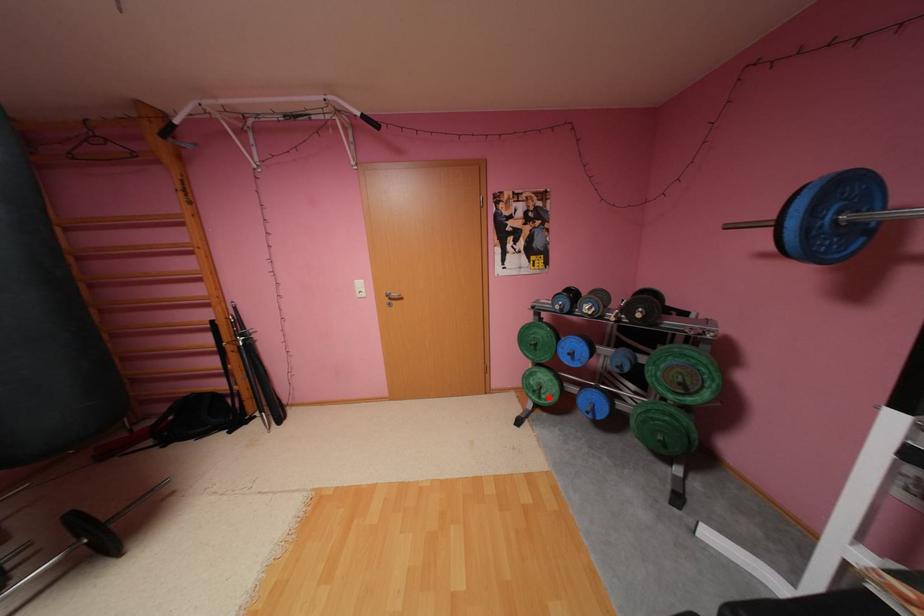
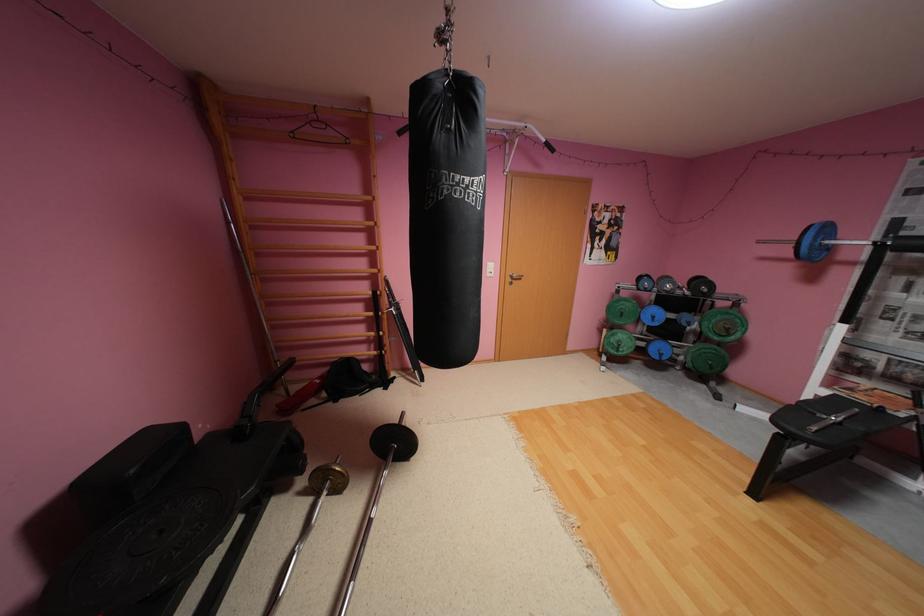
The point at the highlighted location is marked in the first image. Where is the corresponding point in the second image?

(626, 351)